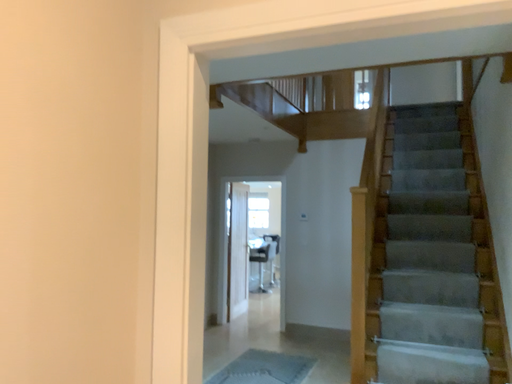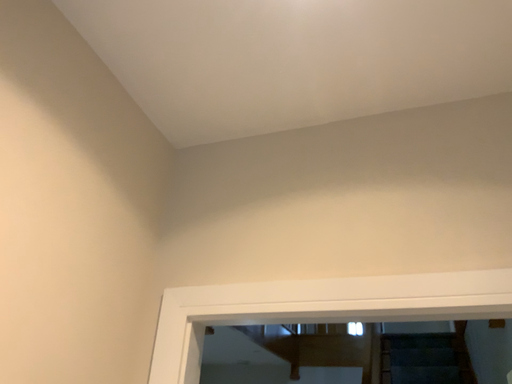
Question: How did the camera likely rotate when shooting the video?

Choices:
 (A) rotated downward
 (B) rotated upward

Answer: (B)